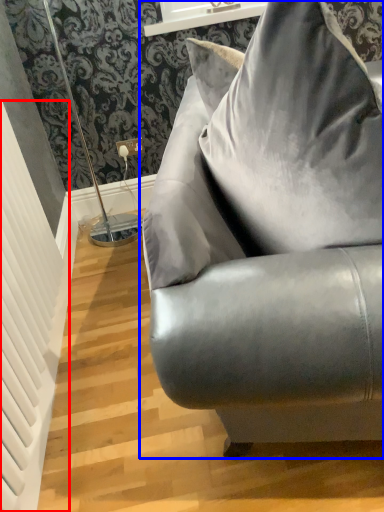
Question: Among these objects, which one is nearest to the camera, radiator (highlighted by a red box) or studio couch (highlighted by a blue box)?

Choices:
 (A) radiator
 (B) studio couch

Answer: (B)